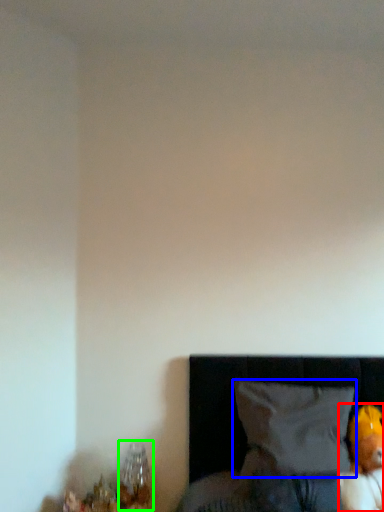
Question: Estimate the real-world distances between objects in this image. Which object is farther from toy (highlighted by a red box), pillow (highlighted by a blue box) or table lamp (highlighted by a green box)?

Choices:
 (A) pillow
 (B) table lamp

Answer: (B)